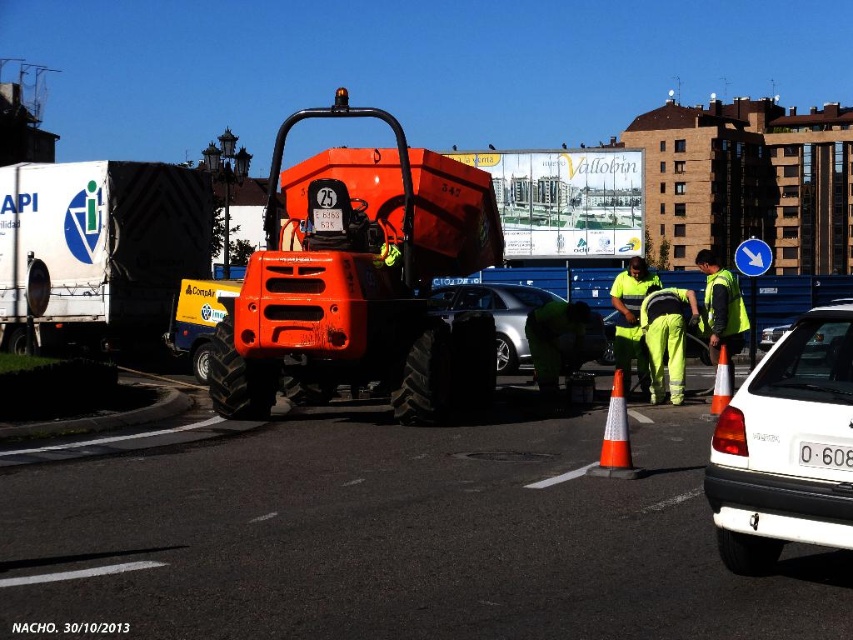
You are a delivery person needing to park your 1.8 meter wide van between the white matte car at right and the metallic silver car at center. Can your van fit in the space between them?

The white matte car at right has a lesser width compared to metallic silver car at center. Since the white matte car at right is narrower, the space between them may be sufficient for a 1.8 meter wide van. However, the exact width of the space isn not specified, so it depends on the actual distance between the cars.

You are a delivery driver who needs to park your truck in the parking lot behind the metallic silver car at center. The parking space is marked with a whiteplasticlicense plate at lower right. Can you fit your truck there?

The metallic silver car at center is larger than the whiteplasticlicense plate at lower right, so the parking space marked by the whiteplasticlicense plate at lower right may be too small for your truck. Check the space dimensions before attempting to park.